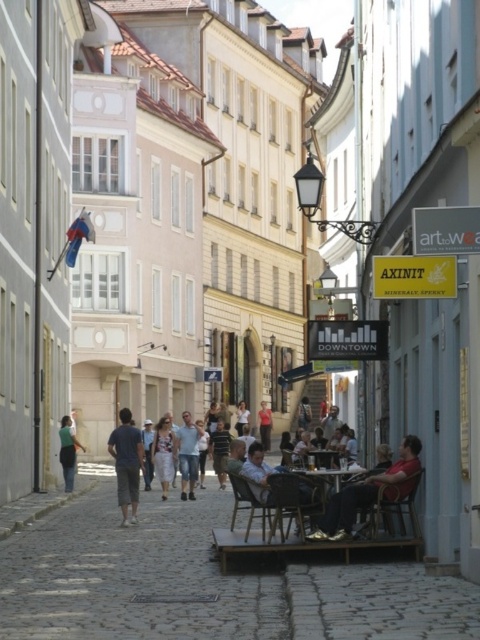
Question: Does wooden table at center appear under light brown leather jacket at center?

Choices:
 (A) no
 (B) yes

Answer: (A)

Question: Can you confirm if wooden table at center is bigger than light brown leather jacket at center?

Choices:
 (A) no
 (B) yes

Answer: (A)

Question: Among these objects, which one is nearest to the camera?

Choices:
 (A) light blue denim shorts at center
 (B) white floral dress at center
 (C) dark green fabric pants at center

Answer: (A)

Question: Which is farther from the wooden table at center?

Choices:
 (A) denim shorts at center
 (B) light blue denim shorts at center
 (C) cobblestone alley at center

Answer: (B)

Question: Which point is farther from the camera taking this photo?

Choices:
 (A) (159, 433)
 (B) (253, 570)
 (C) (264, 436)

Answer: (C)

Question: Can you confirm if matte red shirt at right is wider than dark green fabric pants at center?

Choices:
 (A) yes
 (B) no

Answer: (B)